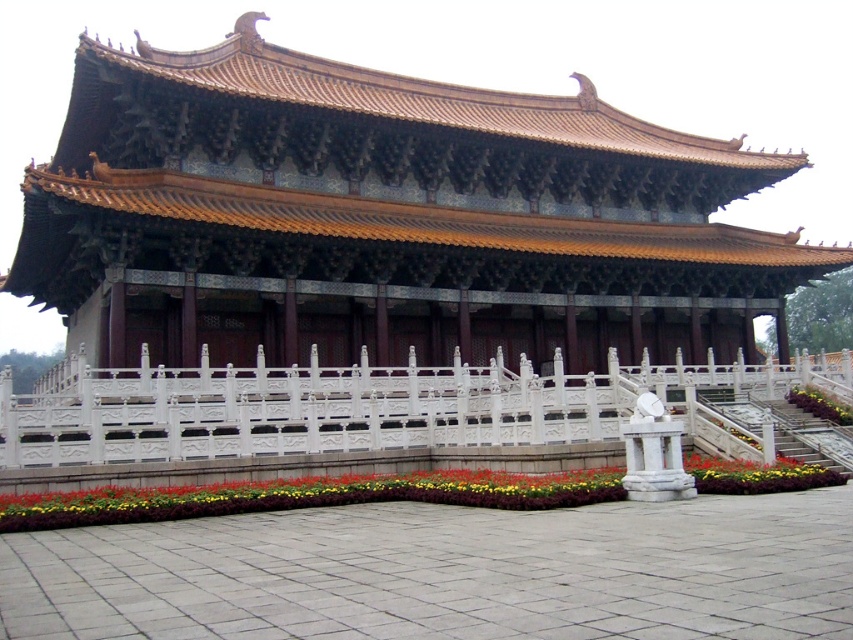
Can you confirm if white stone railing at center is positioned below floral carpet at center?

Incorrect, white stone railing at center is not positioned below floral carpet at center.

Does white stone railing at center have a greater width compared to floral carpet at center?

Correct, the width of white stone railing at center exceeds that of floral carpet at center.

Who is more forward, (32, 460) or (244, 492)?

Point (32, 460) is in front.

I want to click on white stone railing at center, so click(376, 406).

Does golden glazed tile roof at center appear on the left side of white stone railing at center?

Yes, golden glazed tile roof at center is to the left of white stone railing at center.

Who is lower down, golden glazed tile roof at center or white stone railing at center?

white stone railing at center is lower down.

Is point (39, 225) more distant than point (80, 424)?

Yes, point (39, 225) is behind point (80, 424).

This screenshot has height=640, width=853. I want to click on golden glazed tile roof at center, so 387,218.

Does golden glazed tile roof at center appear under floral carpet at center?

No.

Does point (654, 355) lie behind point (711, 472)?

Yes, it is.

At what (x,y) coordinates should I click in order to perform the action: click on golden glazed tile roof at center. Please return your answer as a coordinate pair (x, y). Image resolution: width=853 pixels, height=640 pixels. Looking at the image, I should click on (387, 218).

Locate an element on the screen. golden glazed tile roof at center is located at coordinates (387, 218).